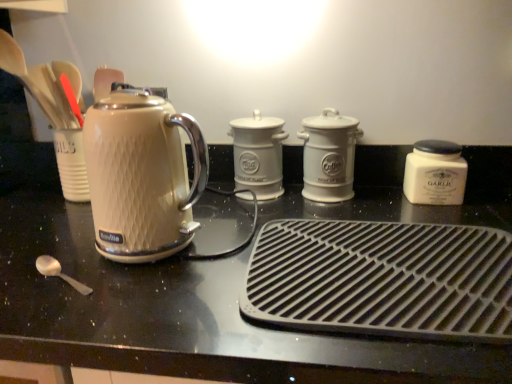
This screenshot has height=384, width=512. In order to click on free region on the left part of white ceramic coffee canister at center, acting as the 2th kitchen appliance starting from the back in this screenshot , I will do `click(246, 200)`.